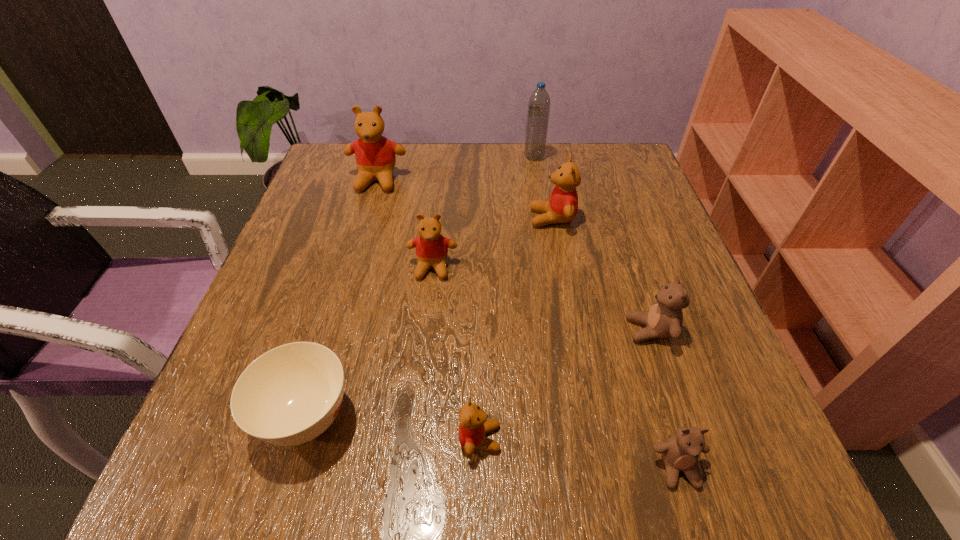
The width and height of the screenshot is (960, 540). Identify the location of sugar bowl. (291, 394).

I want to click on the fourth object from left to right, so click(473, 424).

Find the location of a particular element. This screenshot has width=960, height=540. the nearest red teddy bear is located at coordinates (473, 424).

Locate an element on the screen. The width and height of the screenshot is (960, 540). the smaller brown teddy bear is located at coordinates (681, 452).

Image resolution: width=960 pixels, height=540 pixels. Find the location of `free space located 0.050m on the right of the water bottle`. free space located 0.050m on the right of the water bottle is located at coordinates (564, 157).

Identify the location of vacant position located 0.070m on the front-facing side of the leftmost red teddy bear. (368, 213).

Where is `vacant space situated on the front-facing side of the second farthest teddy bear`? The width and height of the screenshot is (960, 540). vacant space situated on the front-facing side of the second farthest teddy bear is located at coordinates (374, 218).

This screenshot has width=960, height=540. Identify the location of free location located on the front-facing side of the second farthest teddy bear. (x=450, y=218).

Image resolution: width=960 pixels, height=540 pixels. In order to click on vacant space located on the front-facing side of the second farthest teddy bear in this screenshot , I will do `click(486, 218)`.

Locate an element on the screen. Image resolution: width=960 pixels, height=540 pixels. vacant space located 0.240m on the front-facing side of the second smallest red teddy bear is located at coordinates (420, 394).